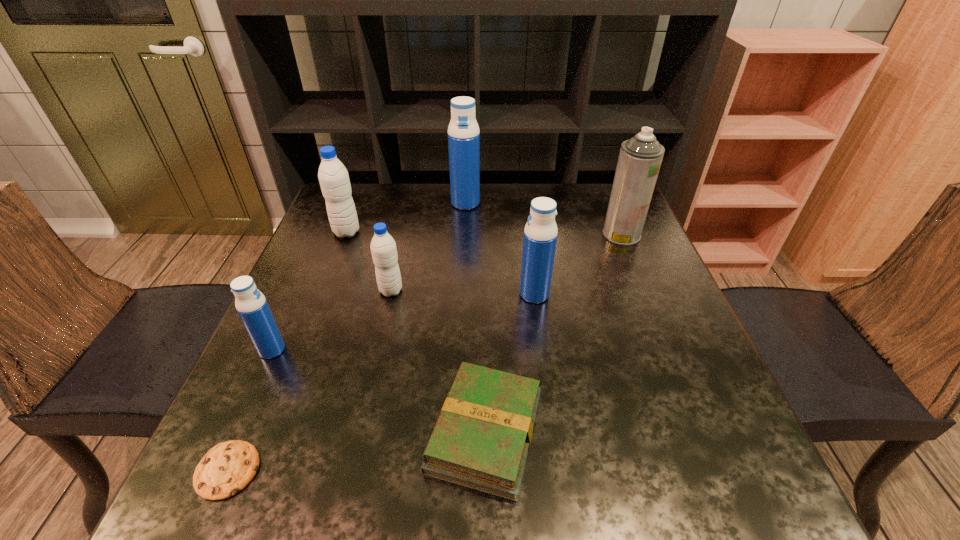
You are a GUI agent. You are given a task and a screenshot of the screen. Output one action in this format:
    pyautogui.click(x=<x>, y=<y>)
    Task: Click on the farthest blue water bottle
    
    Given the screenshot: What is the action you would take?
    pyautogui.click(x=463, y=131)

Locate an element on the screen. This screenshot has width=960, height=540. the second blue water bottle from right to left is located at coordinates (463, 131).

Identify the location of the rightmost object. Image resolution: width=960 pixels, height=540 pixels. (640, 158).

Identify the location of the rightmost water bottle. The width and height of the screenshot is (960, 540). (540, 234).

At what (x,y) coordinates should I click in order to perform the action: click on the rightmost blue water bottle. Please return your answer as a coordinate pair (x, y). Looking at the image, I should click on (540, 234).

The image size is (960, 540). Find the location of `the fourth nearest water bottle`. the fourth nearest water bottle is located at coordinates (334, 180).

The width and height of the screenshot is (960, 540). I want to click on the bigger gray water bottle, so click(x=334, y=180).

The image size is (960, 540). I want to click on the fifth object from right to left, so click(x=383, y=247).

Locate an element on the screen. The height and width of the screenshot is (540, 960). the smaller gray water bottle is located at coordinates pyautogui.click(x=383, y=247).

Identify the location of the third nearest object. (254, 311).